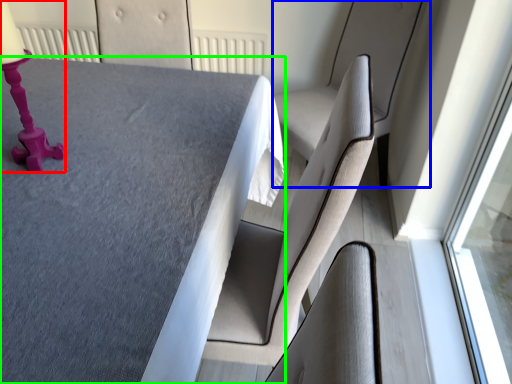
Question: Considering the real-world distances, which object is farthest from table lamp (highlighted by a red box)? swivel chair (highlighted by a blue box) or table (highlighted by a green box)?

Choices:
 (A) swivel chair
 (B) table

Answer: (A)